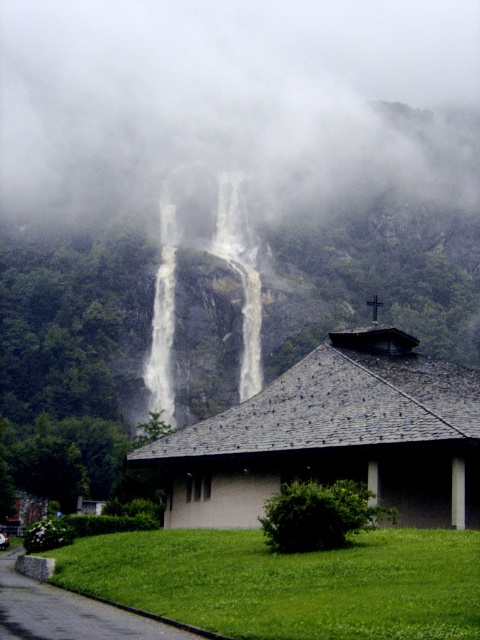
You are standing at the edge of the cliff overlooking the waterfall and notice a point marked at coordinates (232, 100). What is located at this point?

The point at coordinates (232, 100) indicates foggy mist at center.

You are an architect designing a new observation deck near the waterfall. You want to place a viewing platform so that visitors can see the foggy mist at center without obstruction. Based on the scene description, where should you position the platform in relation to the small building with the sloped roof?

The foggy mist at center is located at point (232,100) in the scene. To ensure unobstructed views of the foggy mist at center, the observation deck should be positioned away from the small building with the sloped roof, which is in the foreground, so that the structure does not block the view towards the central area where the mist is situated.